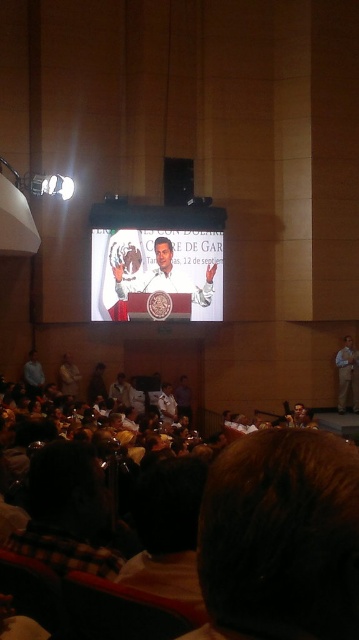
Which is more to the right, matte white podium at center or khaki cotton pants at lower right?

From the viewer's perspective, khaki cotton pants at lower right appears more on the right side.

Can you confirm if matte white podium at center is wider than khaki cotton pants at lower right?

Yes, matte white podium at center is wider than khaki cotton pants at lower right.

The width and height of the screenshot is (359, 640). What do you see at coordinates (156, 257) in the screenshot?
I see `matte white podium at center` at bounding box center [156, 257].

Where is `matte white podium at center`? This screenshot has width=359, height=640. matte white podium at center is located at coordinates (156, 257).